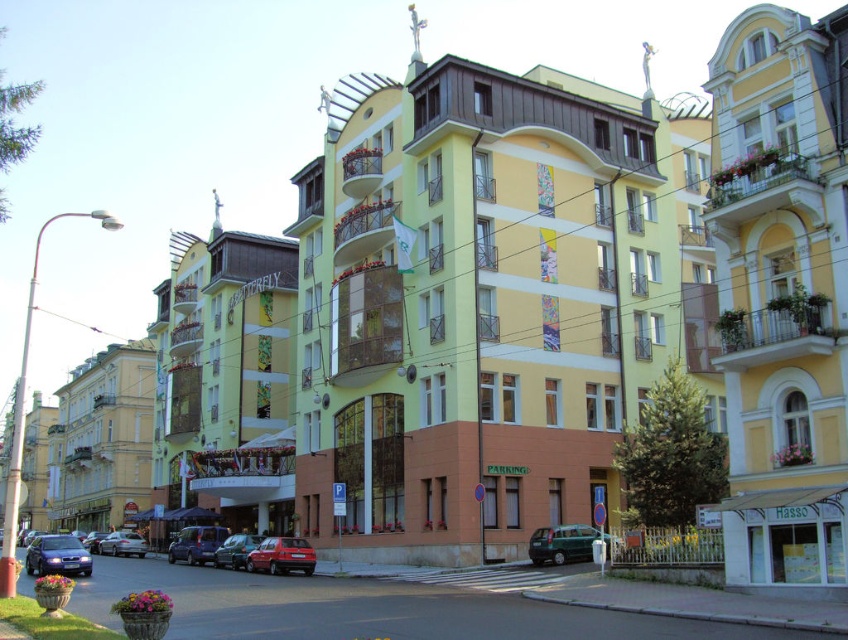
Question: Which is nearer to the yellow matte building at right?

Choices:
 (A) silver metallic sedan at center
 (B) metallic silver car at center
 (C) metallic green van at center
 (D) metallic blue sedan at lower left

Answer: (C)

Question: Where is beige stone building at left located in relation to metallic blue sedan at lower left in the image?

Choices:
 (A) right
 (B) left

Answer: (B)

Question: Among these objects, which one is nearest to the camera?

Choices:
 (A) metallic green van at center
 (B) yellow matte building at right
 (C) metallic silver car at center
 (D) matte red car at lower center

Answer: (B)

Question: Is metallic blue sedan at lower left positioned at the back of silver metallic sedan at center?

Choices:
 (A) no
 (B) yes

Answer: (A)

Question: Which point is farther to the camera?

Choices:
 (A) silver metallic sedan at center
 (B) beige stone building at left
 (C) metallic silver car at center
 (D) metallic silver car at lower left

Answer: (B)

Question: Does metallic green van at center appear on the left side of matte red car at lower center?

Choices:
 (A) no
 (B) yes

Answer: (A)